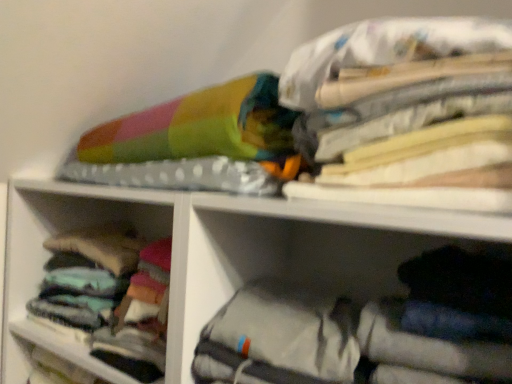
You are a GUI agent. You are given a task and a screenshot of the screen. Output one action in this format:
    pyautogui.click(x=<x>, y=<y>)
    Task: Click on the soft cotton socks at left, arranged as the 2th cabinet when viewed from the front
    
    Given the screenshot: What is the action you would take?
    pyautogui.click(x=50, y=254)

In order to face multicolored fabric at upper right, should I rotate leftwards or rightwards?

Turn right approximately 15.476 degrees to face it.

You are a GUI agent. You are given a task and a screenshot of the screen. Output one action in this format:
    pyautogui.click(x=<x>, y=<y>)
    Task: Click on the soft cotton socks at left, placed as the 2th cabinet when sorted from right to left
    
    Given the screenshot: What is the action you would take?
    (x=50, y=254)

Considering the sizes of objects soft cotton socks at left, arranged as the 2th cabinet when viewed from the front, and gray fabric bag at lower right, placed as the first cabinet when sorted from right to left, in the image provided, who is smaller, soft cotton socks at left, arranged as the 2th cabinet when viewed from the front, or gray fabric bag at lower right, placed as the first cabinet when sorted from right to left,?

soft cotton socks at left, arranged as the 2th cabinet when viewed from the front.

Considering the relative sizes of soft cotton socks at left, the first cabinet positioned from the left, and gray fabric bag at lower right, placed as the first cabinet when sorted from right to left, in the image provided, is soft cotton socks at left, the first cabinet positioned from the left, taller than gray fabric bag at lower right, placed as the first cabinet when sorted from right to left,?

Yes.

Do you think soft cotton socks at left, placed as the 2th cabinet when sorted from right to left, is within gray fabric bag at lower right, the second cabinet from the back, or outside of it?

soft cotton socks at left, placed as the 2th cabinet when sorted from right to left, is not enclosed by gray fabric bag at lower right, the second cabinet from the back.

Considering the positions of objects soft cotton socks at left, the first cabinet positioned from the left, and gray fabric bag at lower right, positioned as the first cabinet in front-to-back order, in the image provided, who is more to the right, soft cotton socks at left, the first cabinet positioned from the left, or gray fabric bag at lower right, positioned as the first cabinet in front-to-back order,?

gray fabric bag at lower right, positioned as the first cabinet in front-to-back order, is more to the right.

From the image's perspective, is multicolored fabric at upper right positioned above or below soft cotton socks at left, the first cabinet positioned from the left?

From the image's perspective, multicolored fabric at upper right appears above soft cotton socks at left, the first cabinet positioned from the left.

Would you consider multicolored fabric at upper right to be distant from soft cotton socks at left, the first cabinet positioned from the left?

No.

Who is bigger, multicolored fabric at upper right or soft cotton socks at left, the 1th cabinet viewed from the back?

soft cotton socks at left, the 1th cabinet viewed from the back, is bigger.

Which object is positioned more to the right, multicolored fabric at upper right or soft cotton socks at left, the first cabinet positioned from the left?

multicolored fabric at upper right is more to the right.

Looking at this image, is gray fabric bag at lower right, the second cabinet from the back, located outside multicolored fabric at upper right?

gray fabric bag at lower right, the second cabinet from the back, is positioned outside multicolored fabric at upper right.

The width and height of the screenshot is (512, 384). What are the coordinates of `cabinet that is the 1st object directly below the multicolored fabric at upper right (from a real-world perspective)` in the screenshot? It's located at (344, 288).

Is gray fabric bag at lower right, the second cabinet from the back, far from multicolored fabric at upper right?

No.

Is gray fabric bag at lower right, positioned as the first cabinet in front-to-back order, thinner than multicolored fabric at upper right?

No.

Based on the photo, is soft cotton socks at left, arranged as the 2th cabinet when viewed from the front, not inside multicolored fabric at upper right?

Absolutely, soft cotton socks at left, arranged as the 2th cabinet when viewed from the front, is external to multicolored fabric at upper right.

Image resolution: width=512 pixels, height=384 pixels. I want to click on the 2nd cabinet counting from the left side of the multicolored fabric at upper right, so click(x=50, y=254).

Would you say soft cotton socks at left, arranged as the 2th cabinet when viewed from the front, is to the left or to the right of multicolored fabric at upper right in the picture?

From the image, it's evident that soft cotton socks at left, arranged as the 2th cabinet when viewed from the front, is to the left of multicolored fabric at upper right.

Can you tell me how much soft cotton socks at left, the first cabinet positioned from the left, and multicolored fabric at upper right differ in facing direction?

2.75 degrees.

Who is shorter, multicolored fabric at upper right or gray fabric bag at lower right, placed as the first cabinet when sorted from right to left?

gray fabric bag at lower right, placed as the first cabinet when sorted from right to left, is shorter.

Between multicolored fabric at upper right and gray fabric bag at lower right, placed as the first cabinet when sorted from right to left, which one is positioned behind?

gray fabric bag at lower right, placed as the first cabinet when sorted from right to left, is more distant.

From the image's perspective, is multicolored fabric at upper right above or below gray fabric bag at lower right, the 2th cabinet when ordered from left to right?

multicolored fabric at upper right is situated higher than gray fabric bag at lower right, the 2th cabinet when ordered from left to right, in the image.

Considering the sizes of objects multicolored fabric at upper right and gray fabric bag at lower right, the second cabinet from the back, in the image provided, who is bigger, multicolored fabric at upper right or gray fabric bag at lower right, the second cabinet from the back,?

gray fabric bag at lower right, the second cabinet from the back.

Considering the sizes of objects gray fabric bag at lower right, placed as the first cabinet when sorted from right to left, and soft cotton socks at left, arranged as the 2th cabinet when viewed from the front, in the image provided, who is taller, gray fabric bag at lower right, placed as the first cabinet when sorted from right to left, or soft cotton socks at left, arranged as the 2th cabinet when viewed from the front,?

With more height is soft cotton socks at left, arranged as the 2th cabinet when viewed from the front.

From a real-world perspective, which object rests below the other?

soft cotton socks at left, arranged as the 2th cabinet when viewed from the front, from a real-world perspective.

The width and height of the screenshot is (512, 384). In the image, there is a gray fabric bag at lower right, placed as the first cabinet when sorted from right to left. Find the location of `cabinet above it (from the image's perspective)`. cabinet above it (from the image's perspective) is located at coordinates (50, 254).

The height and width of the screenshot is (384, 512). Find the location of `cabinet below the soft cotton socks at left, placed as the 2th cabinet when sorted from right to left (from the image's perspective)`. cabinet below the soft cotton socks at left, placed as the 2th cabinet when sorted from right to left (from the image's perspective) is located at coordinates (344, 288).

I want to click on clothing that is above the soft cotton socks at left, the first cabinet positioned from the left (from the image's perspective), so click(x=408, y=112).

When comparing their distances from soft cotton socks at left, placed as the 2th cabinet when sorted from right to left, does gray fabric bag at lower right, positioned as the first cabinet in front-to-back order, or multicolored fabric at upper right seem further?

Based on the image, multicolored fabric at upper right appears to be further to soft cotton socks at left, placed as the 2th cabinet when sorted from right to left.

Looking at the image, which one is located further to gray fabric bag at lower right, the 2th cabinet when ordered from left to right, soft cotton socks at left, placed as the 2th cabinet when sorted from right to left, or multicolored fabric at upper right?

Based on the image, soft cotton socks at left, placed as the 2th cabinet when sorted from right to left, appears to be further to gray fabric bag at lower right, the 2th cabinet when ordered from left to right.

Considering their positions, is soft cotton socks at left, placed as the 2th cabinet when sorted from right to left, positioned closer to multicolored fabric at upper right than gray fabric bag at lower right, the second cabinet from the back?

gray fabric bag at lower right, the second cabinet from the back, lies closer to multicolored fabric at upper right than the other object.

Considering their positions, is gray fabric bag at lower right, placed as the first cabinet when sorted from right to left, positioned further to multicolored fabric at upper right than soft cotton socks at left, arranged as the 2th cabinet when viewed from the front?

soft cotton socks at left, arranged as the 2th cabinet when viewed from the front, lies further to multicolored fabric at upper right than the other object.

From the picture: Estimate the real-world distances between objects in this image. Which object is further from soft cotton socks at left, the 1th cabinet viewed from the back, multicolored fabric at upper right or gray fabric bag at lower right, the second cabinet from the back?

Result: multicolored fabric at upper right is further to soft cotton socks at left, the 1th cabinet viewed from the back.

From the image, which object appears to be farther from gray fabric bag at lower right, positioned as the first cabinet in front-to-back order, multicolored fabric at upper right or soft cotton socks at left, placed as the 2th cabinet when sorted from right to left?

soft cotton socks at left, placed as the 2th cabinet when sorted from right to left, lies further to gray fabric bag at lower right, positioned as the first cabinet in front-to-back order, than the other object.

At what (x,y) coordinates should I click in order to perform the action: click on cabinet between soft cotton socks at left, the first cabinet positioned from the left, and multicolored fabric at upper right, in the horizontal direction. Please return your answer as a coordinate pair (x, y). Looking at the image, I should click on (344, 288).